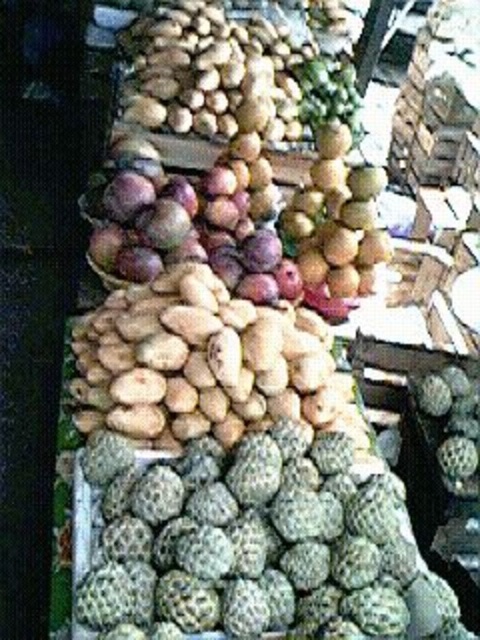
You are a customer at the market and want to buy both the green rough textured fruit at lower center and the shiny purple plums at center. If you start from the left side of the display, which fruit should you pick up first to get the correct order?

Since the green rough textured fruit at lower center is to the right of the shiny purple plums at center, you should pick up the shiny purple plums at center first when starting from the left side.

From the picture: You are a customer at the market looking to buy fruits. You see the green rough textured fruit at lower center and the shiny purple plums at center. Which of these two fruits is taller in the stack?

The shiny purple plums at center are taller than the green rough textured fruit at lower center according to the description.